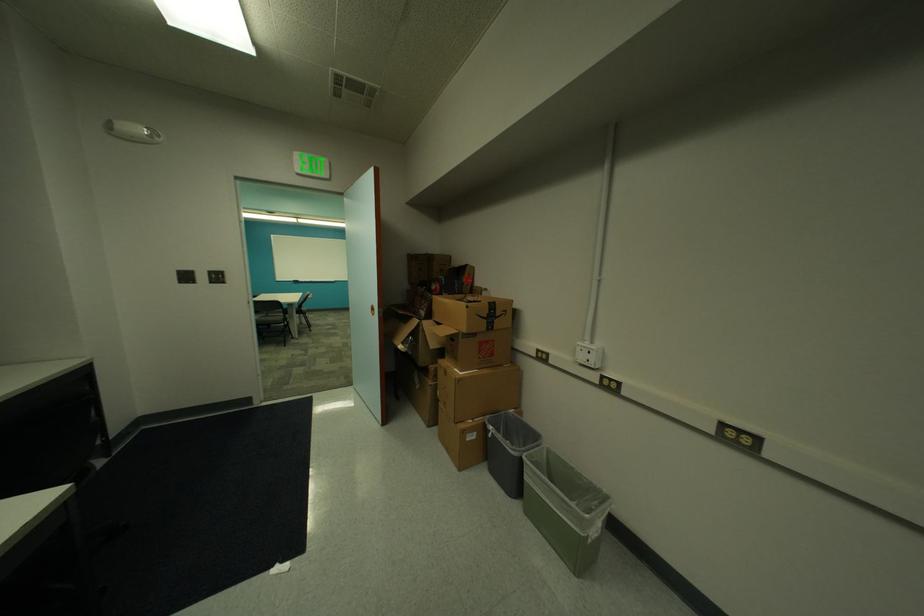
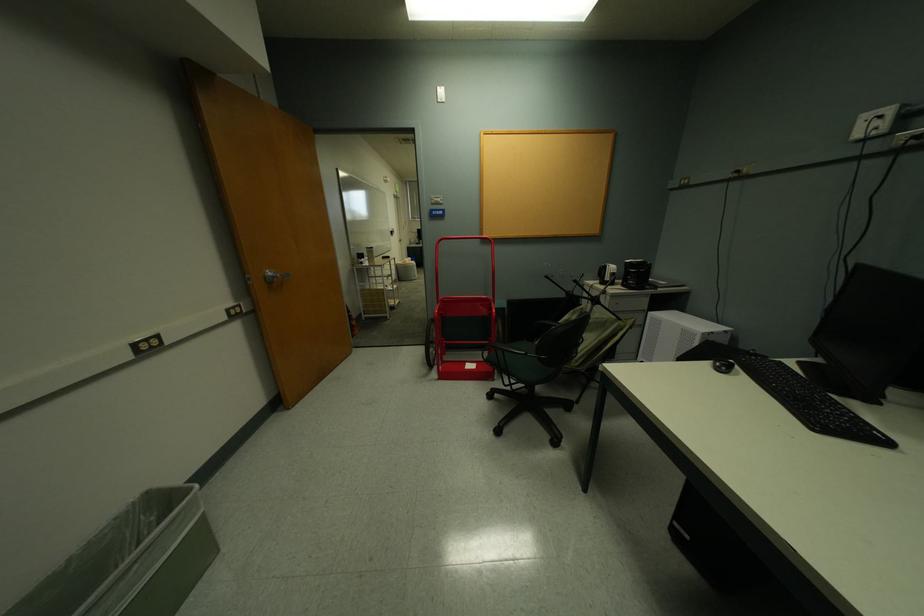
Locate, in the second image, the point that corresponds to (582,469) in the first image.

(79, 560)